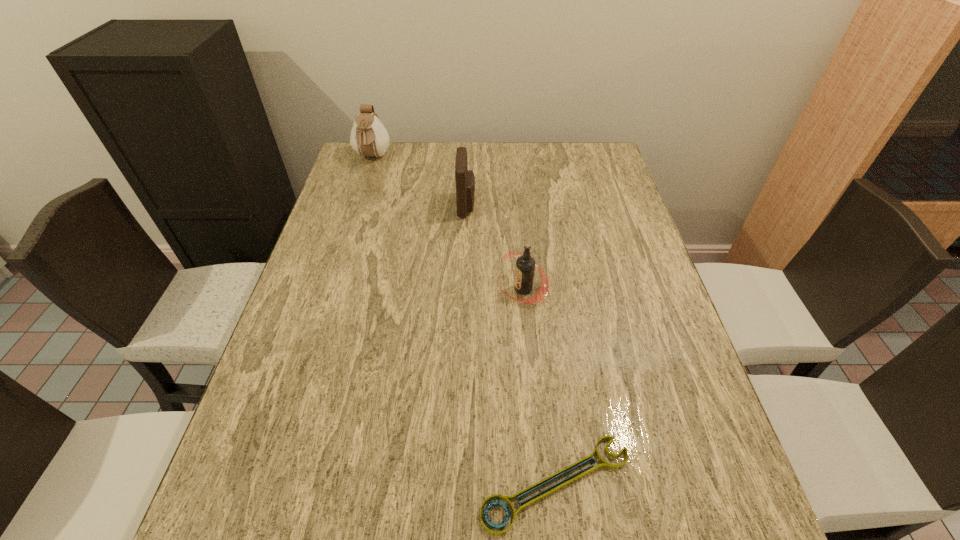
At what (x,y) coordinates should I click in order to perform the action: click on vacant space located 0.190m on the label of the root beer. Please return your answer as a coordinate pair (x, y). The image size is (960, 540). Looking at the image, I should click on (420, 288).

The height and width of the screenshot is (540, 960). In order to click on vacant space located on the label of the root beer in this screenshot , I will do `click(448, 288)`.

Find the location of `free spot located on the back of the nearest object`. free spot located on the back of the nearest object is located at coordinates (537, 312).

At what (x,y) coordinates should I click in order to perform the action: click on object that is at the far edge. Please return your answer as a coordinate pair (x, y). This screenshot has width=960, height=540. Looking at the image, I should click on (369, 138).

The height and width of the screenshot is (540, 960). Find the location of `object located in the near edge section of the desktop`. object located in the near edge section of the desktop is located at coordinates (580, 474).

You are a GUI agent. You are given a task and a screenshot of the screen. Output one action in this format:
    pyautogui.click(x=<x>, y=<y>)
    Task: Click on the object that is at the left edge
    This screenshot has height=540, width=960.
    Given the screenshot: What is the action you would take?
    pyautogui.click(x=369, y=138)

You are a GUI agent. You are given a task and a screenshot of the screen. Output one action in this format:
    pyautogui.click(x=<x>, y=<y>)
    Task: Click on the object at the far left corner
    This screenshot has height=540, width=960.
    Given the screenshot: What is the action you would take?
    pyautogui.click(x=369, y=138)

This screenshot has width=960, height=540. Find the location of `free point at the far edge`. free point at the far edge is located at coordinates (491, 172).

Identify the location of blank space at the right edge of the desktop. This screenshot has height=540, width=960. (594, 274).

The image size is (960, 540). I want to click on free region at the far right corner of the desktop, so pos(580,157).